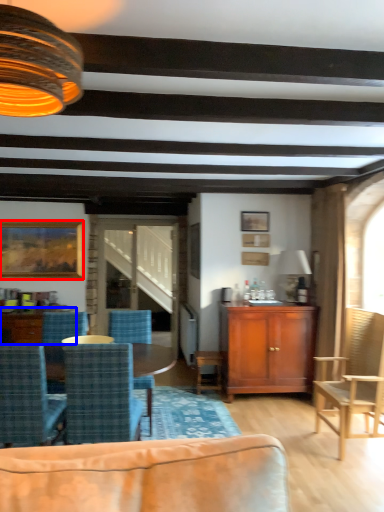
Question: Which point is further to the camera, picture frame (highlighted by a red box) or coffee table (highlighted by a blue box)?

Choices:
 (A) picture frame
 (B) coffee table

Answer: (A)